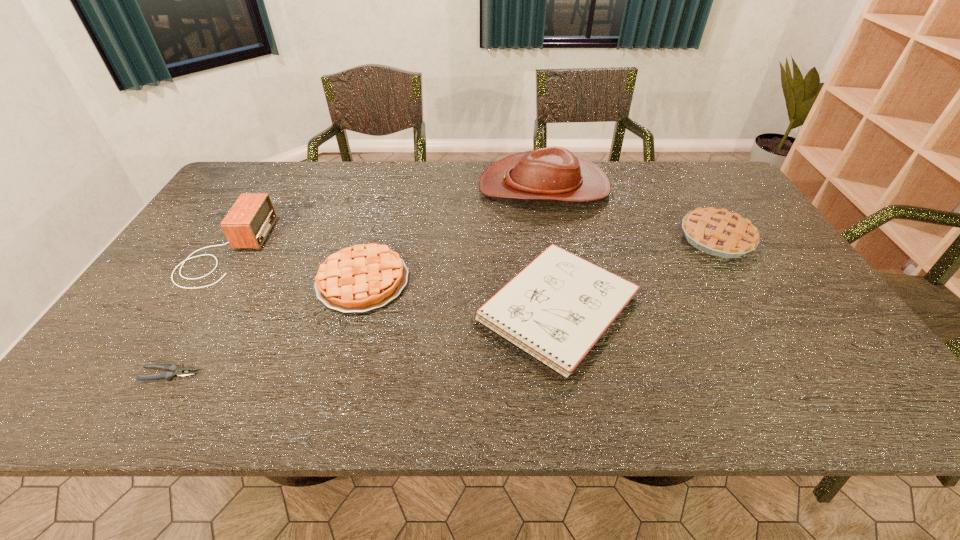
Find the location of a particular element. This screenshot has width=960, height=540. the tallest object is located at coordinates (553, 173).

Where is `cowboy hat`? The width and height of the screenshot is (960, 540). cowboy hat is located at coordinates (553, 173).

This screenshot has width=960, height=540. What are the coordinates of `the second tallest object` in the screenshot? It's located at (249, 221).

Image resolution: width=960 pixels, height=540 pixels. I want to click on the right pie, so click(x=718, y=232).

Find the location of a particular element. This screenshot has width=960, height=540. the left pie is located at coordinates (363, 277).

Find the location of `notepad`. notepad is located at coordinates (556, 309).

Identify the location of the shortest object. The image size is (960, 540). (174, 371).

The width and height of the screenshot is (960, 540). Find the location of `free spot located on the front-facing side of the cowboy hat`. free spot located on the front-facing side of the cowboy hat is located at coordinates (395, 187).

I want to click on free space located 0.280m on the front-facing side of the cowboy hat, so click(x=395, y=187).

At what (x,y) coordinates should I click in order to perform the action: click on free space located on the front-facing side of the cowboy hat. Please return your answer as a coordinate pair (x, y). Looking at the image, I should click on (400, 187).